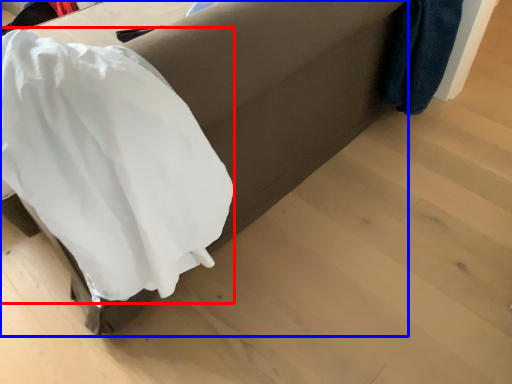
Question: Among these objects, which one is nearest to the camera, clothing (highlighted by a red box) or furniture (highlighted by a blue box)?

Choices:
 (A) clothing
 (B) furniture

Answer: (A)